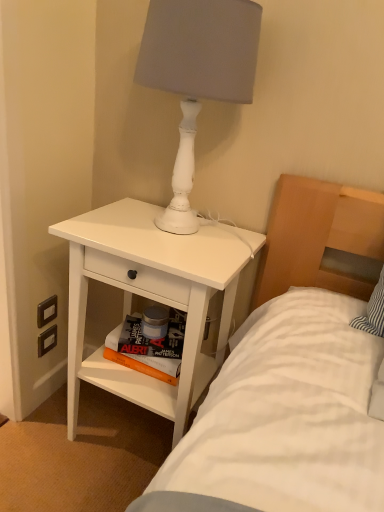
Where is `free space on the front side of white matte lamp at upper right`? Image resolution: width=384 pixels, height=512 pixels. free space on the front side of white matte lamp at upper right is located at coordinates (171, 257).